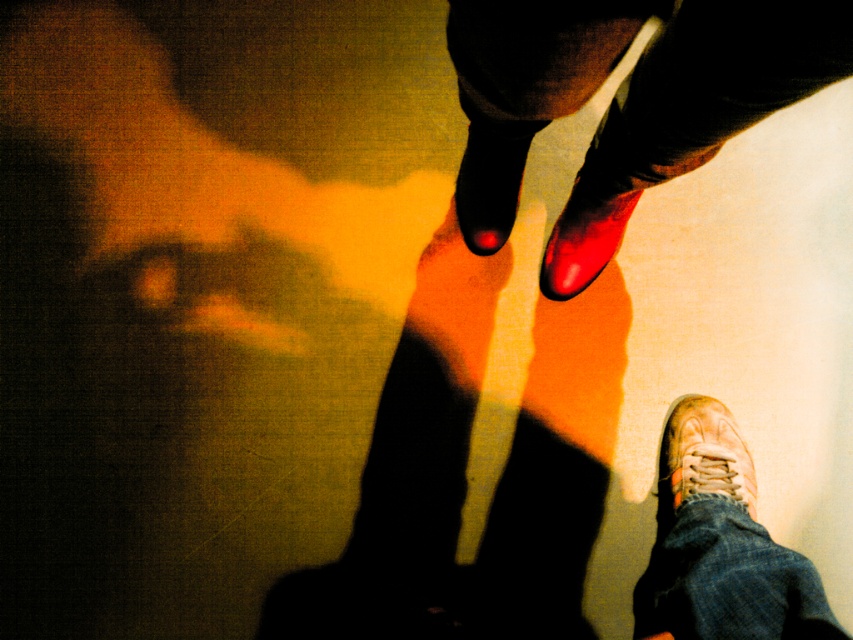
Where is `shiny red nail polish at center`? shiny red nail polish at center is located at coordinates (622, 100).

From the picture: Does shiny red nail polish at center appear on the left side of brown leather shoe at lower right?

Correct, you'll find shiny red nail polish at center to the left of brown leather shoe at lower right.

Which is in front, point (822, 58) or point (730, 476)?

Positioned in front is point (822, 58).

The image size is (853, 640). In order to click on shiny red nail polish at center in this screenshot , I will do `click(622, 100)`.

Between brown leather shoe at lower right and shiny black shoe at center, which one is positioned higher?

Answer: Positioned higher is shiny black shoe at center.

Who is positioned more to the left, brown leather shoe at lower right or shiny black shoe at center?

shiny black shoe at center is more to the left.

Is point (743, 490) farther from viewer compared to point (517, 140)?

Yes, point (743, 490) is farther from viewer.

This screenshot has width=853, height=640. I want to click on brown leather shoe at lower right, so click(x=701, y=458).

Which is more to the left, shiny red nail polish at center or shiny red shoe at center?

Positioned to the left is shiny red nail polish at center.

Based on the photo, is shiny red nail polish at center to the left of shiny red shoe at center from the viewer's perspective?

Yes, shiny red nail polish at center is to the left of shiny red shoe at center.

Between point (747, 28) and point (601, 211), which one is positioned behind?

The point (601, 211) is more distant.

Identify the location of shiny red nail polish at center. (622, 100).